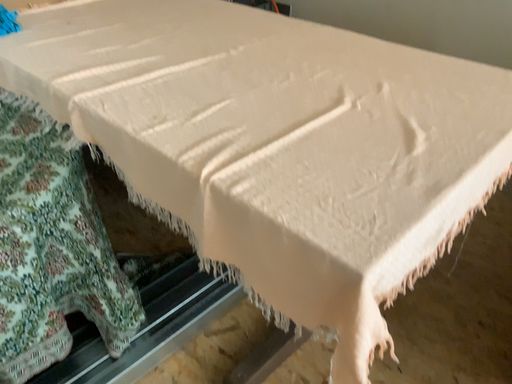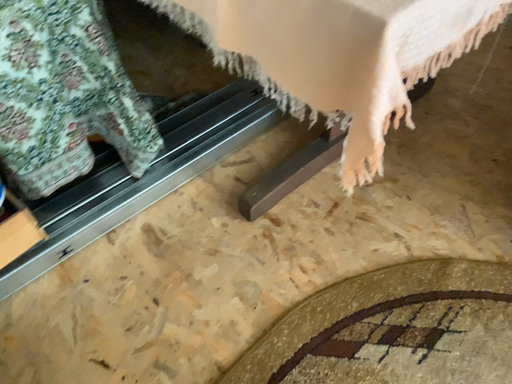
Question: How did the camera likely rotate when shooting the video?

Choices:
 (A) rotated downward
 (B) rotated upward

Answer: (A)